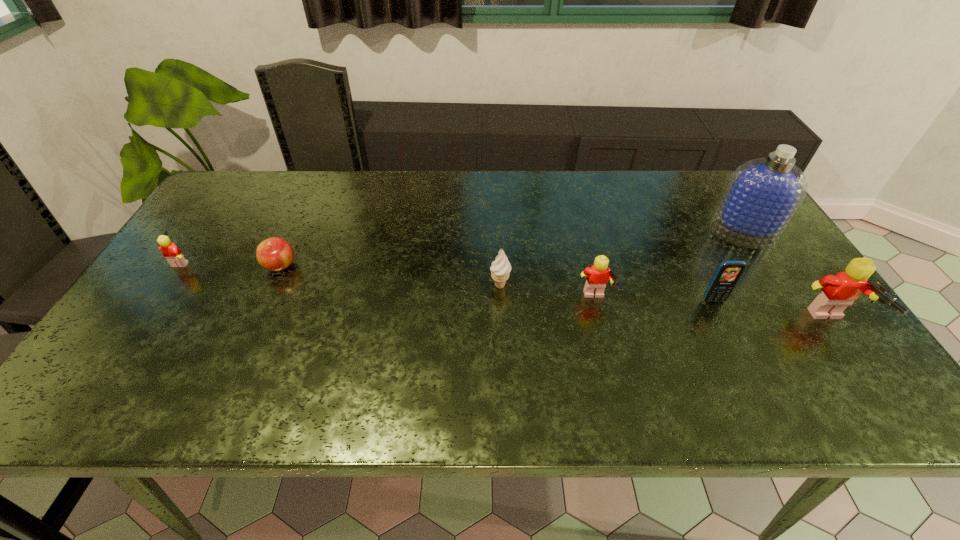
This screenshot has height=540, width=960. I want to click on free point between the leftmost Lego and the rightmost Lego, so click(508, 292).

I want to click on vacant area that lies between the cellular telephone and the icecream, so click(607, 293).

This screenshot has height=540, width=960. I want to click on free space between the second object from left to right and the second tallest Lego, so click(438, 283).

The height and width of the screenshot is (540, 960). I want to click on vacant area that lies between the cellular telephone and the icecream, so click(x=607, y=293).

Where is `free space between the cleansing agent and the shortest Lego`? free space between the cleansing agent and the shortest Lego is located at coordinates (462, 247).

This screenshot has width=960, height=540. What are the coordinates of `free space between the second shortest object and the apple` in the screenshot? It's located at (231, 263).

Identify the location of free spot between the cleansing agent and the third object from left to right. (621, 260).

Select which object is the sixth closest to the leftmost object. Please provide its 2D coordinates. Your answer should be formatted as a tuple, i.e. [(x, y)], where the tuple contains the x and y coordinates of a point satisfying the conditions above.

[(839, 291)]

The width and height of the screenshot is (960, 540). I want to click on object that is the fifth closest to the second Lego from left to right, so click(x=275, y=254).

The image size is (960, 540). I want to click on the third closest Lego relative to the cleansing agent, so click(x=170, y=251).